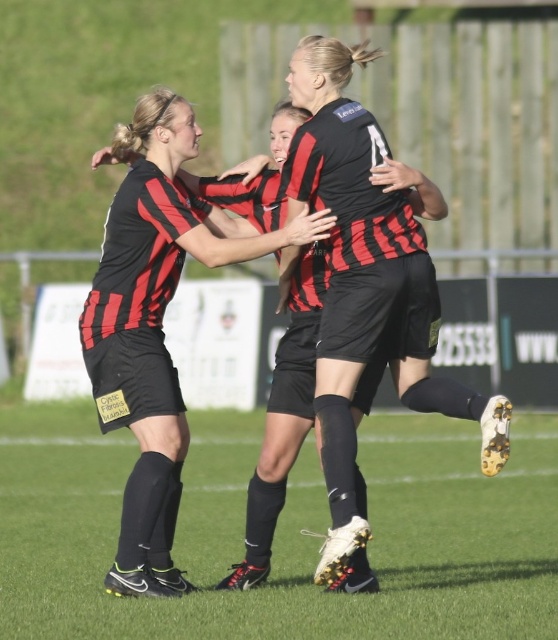
You are a photographer standing at the edge of the soccer field. You want to capture a photo of the matte black soccer uniform at center without the black synthetic football boot at lower center blocking the view. Is the boot currently in front of the uniform?

The black synthetic football boot at lower center is in front of matte black soccer uniform at center, so yes, the boot is blocking the view of the uniform.

You are a soccer equipment manager checking the inventory. You need to store both the black synthetic football boot at lower center and the matte black soccer uniform at center. If the storage bin can only accommodate items up to the size of the uniform, will the boot fit?

The black synthetic football boot at lower center is larger in size than the matte black soccer uniform at center, so it will not fit in the storage bin designed for the uniform size.